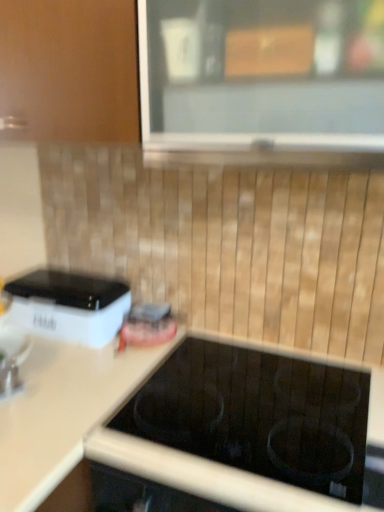
Find the location of a particular element. The height and width of the screenshot is (512, 384). empty space that is to the right of metallic faucet at lower left is located at coordinates (76, 387).